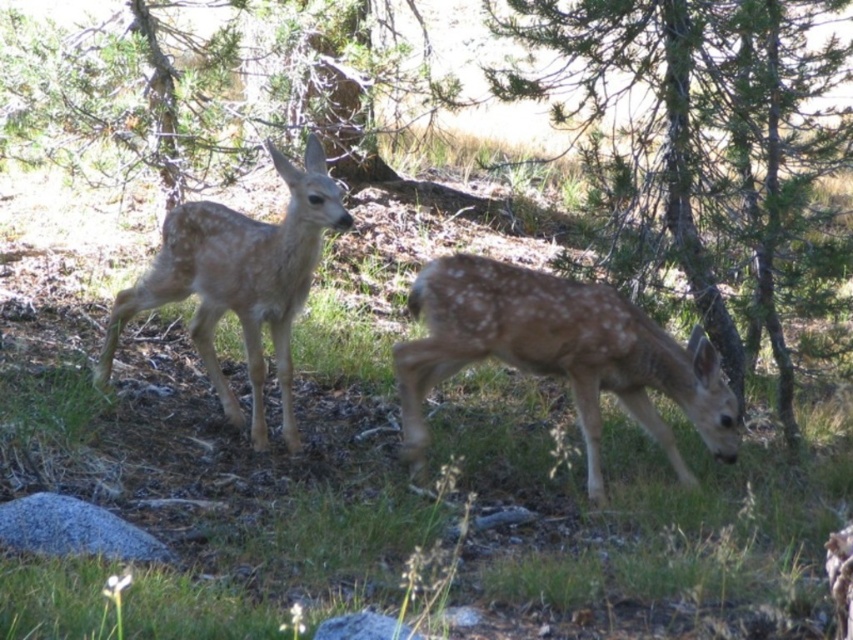
Question: Where is green textured tree at center right located in relation to fawn fur fawn at center in the image?

Choices:
 (A) below
 (B) above

Answer: (B)

Question: Which point is closer to the camera?

Choices:
 (A) (796, 16)
 (B) (97, 368)

Answer: (B)

Question: Does green textured tree at center right appear over fawn fur fawn at center?

Choices:
 (A) no
 (B) yes

Answer: (B)

Question: Which point is closer to the camera taking this photo?

Choices:
 (A) (318, 218)
 (B) (601, 476)

Answer: (A)

Question: In this image, where is green textured tree at center right located relative to spotted fur deer at center?

Choices:
 (A) below
 (B) above

Answer: (B)

Question: Which point is closer to the camera taking this photo?

Choices:
 (A) (254, 321)
 (B) (689, 122)
 (C) (582, 349)

Answer: (C)